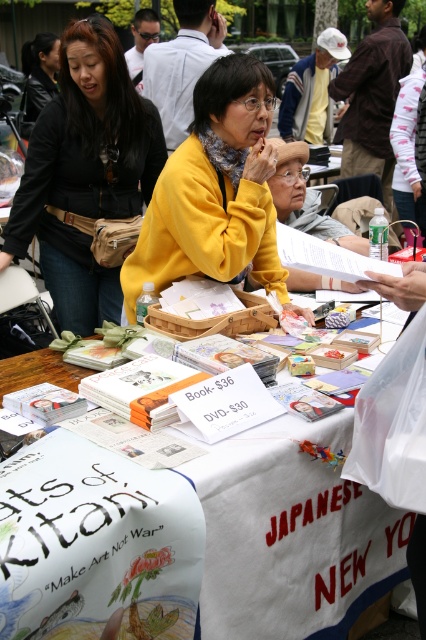
You are at the market and want to buy the matte yellow sweater at center. Which direction should you move relative to the matte black jacket at upper left to reach it?

The matte black jacket at upper left is to the left of the matte yellow sweater at center. So, you should move to the right from the matte black jacket at upper left to reach the matte yellow sweater at center.

You are a customer at the market and want to buy the white fabric at center. The vendor mentions that the matte black jacket at upper left is also for sale. Which item takes up more space on the table?

The matte black jacket at upper left takes up more space on the table because it is larger than the white fabric at center.

In the scene shown: You are a customer at the market and want to buy the white fabric at center. The vendor is wearing a matte black jacket at upper left. Which item is closer to you, the customer, if you are standing in front of the table?

The white fabric at center is closer to you than the matte black jacket at upper left because the white fabric at center is not as tall as the matte black jacket at upper left, indicating it is positioned closer to the front of the table.